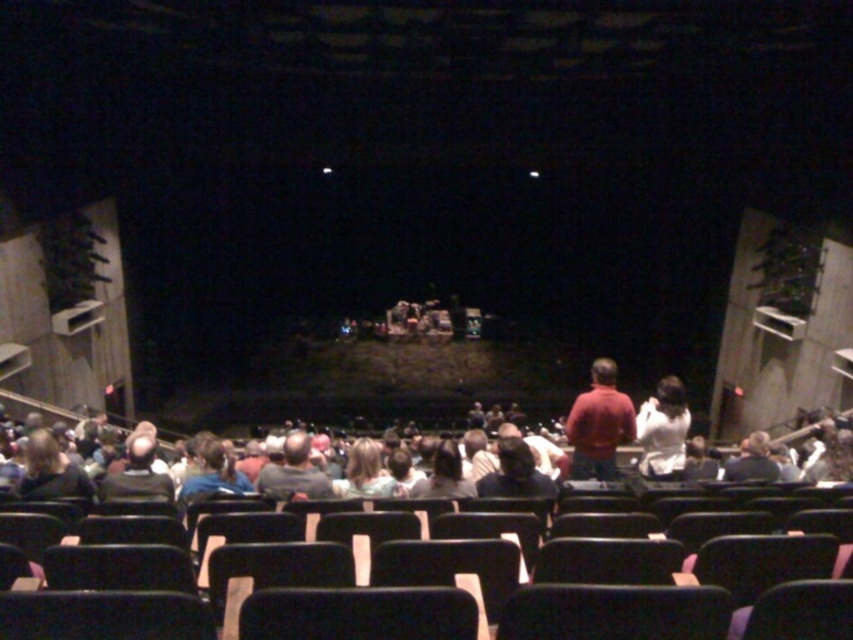
How far apart are matte red shirt at center and dark gray sweater at lower left?

The distance of matte red shirt at center from dark gray sweater at lower left is 5.83 meters.

Between point (585, 403) and point (33, 449), which one is positioned in front?

Point (33, 449) is more forward.

Does point (624, 413) come in front of point (32, 433)?

Yes, it is in front of point (32, 433).

Find the location of a particular element. Image resolution: width=853 pixels, height=640 pixels. matte red shirt at center is located at coordinates (599, 424).

Can you confirm if white fabric at center is positioned above dark gray sweater at lower left?

No, white fabric at center is not above dark gray sweater at lower left.

Does point (636, 428) lie in front of point (25, 488)?

No.

The height and width of the screenshot is (640, 853). What do you see at coordinates (663, 428) in the screenshot?
I see `white fabric at center` at bounding box center [663, 428].

Locate an element on the screen. The image size is (853, 640). white fabric at center is located at coordinates (663, 428).

Does white fabric at center have a smaller size compared to dark gray shirt at center?

Yes, white fabric at center is smaller than dark gray shirt at center.

Is white fabric at center in front of dark gray shirt at center?

No.

The width and height of the screenshot is (853, 640). I want to click on white fabric at center, so click(x=663, y=428).